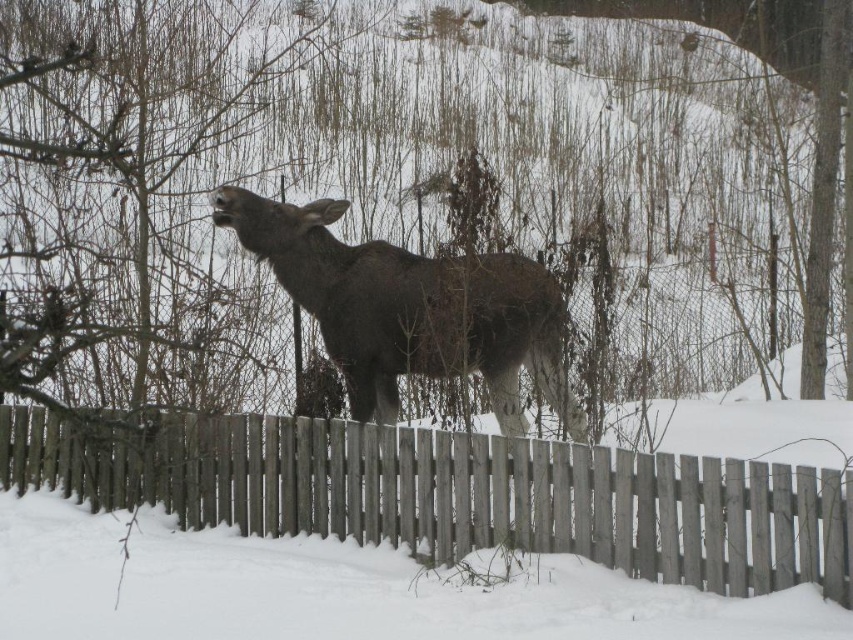
Between wooden picket fence at center and dark brown fur at center, which one is positioned higher?

Positioned higher is dark brown fur at center.

Between point (705, 509) and point (416, 372), which one is positioned in front?

Point (705, 509) is more forward.

Locate an element on the screen. Image resolution: width=853 pixels, height=640 pixels. wooden picket fence at center is located at coordinates [462, 493].